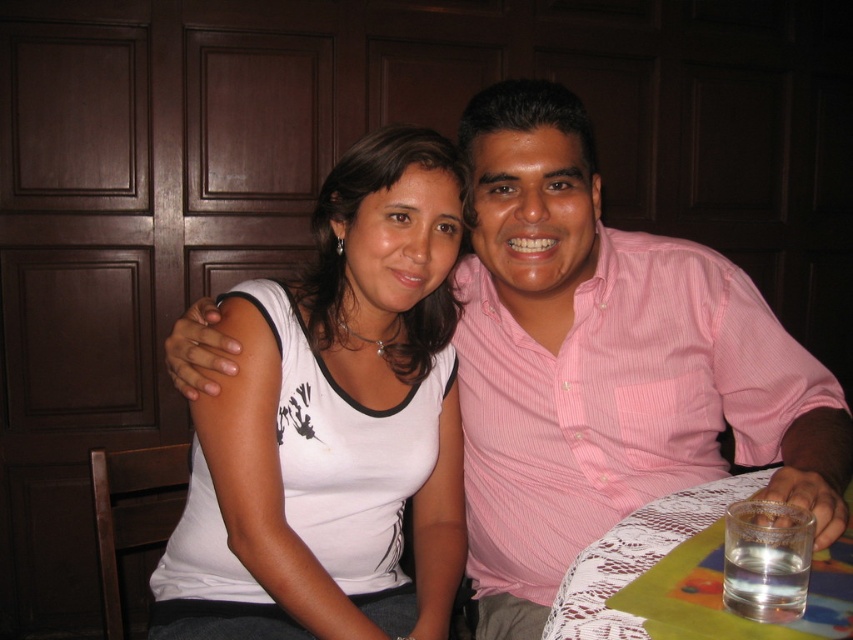
Between point (561, 195) and point (735, 324), which one is positioned in front?

Point (561, 195) is more forward.

Can you confirm if pink striped shirt at center is wider than pink striped shirt at right?

Correct, the width of pink striped shirt at center exceeds that of pink striped shirt at right.

Is point (689, 445) positioned after point (782, 365)?

Yes, point (689, 445) is farther from viewer.

Locate an element on the screen. pink striped shirt at center is located at coordinates (606, 364).

Which of these two, pink striped shirt at center or lace fabric tablecloth at lower right, stands taller?

pink striped shirt at center is taller.

Between point (540, 308) and point (699, 522), which one is positioned in front?

Positioned in front is point (699, 522).

Between point (614, 468) and point (556, 634), which one is positioned behind?

The point (614, 468) is behind.

Where is `pink striped shirt at center`? The image size is (853, 640). pink striped shirt at center is located at coordinates (606, 364).

Does pink striped shirt at center have a larger size compared to white matte tank top at center?

Indeed, pink striped shirt at center has a larger size compared to white matte tank top at center.

Is pink striped shirt at center to the right of white matte tank top at center from the viewer's perspective?

Indeed, pink striped shirt at center is positioned on the right side of white matte tank top at center.

Between point (564, 307) and point (241, 426), which one is positioned in front?

Positioned in front is point (241, 426).

This screenshot has width=853, height=640. I want to click on pink striped shirt at center, so click(x=606, y=364).